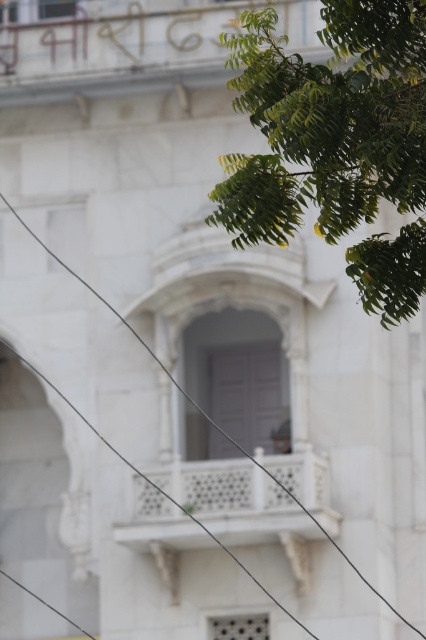
Question: Can you confirm if green leafy tree at upper right is thinner than black wire at upper left?

Choices:
 (A) no
 (B) yes

Answer: (B)

Question: Is green leafy tree at upper right bigger than black wire at upper left?

Choices:
 (A) yes
 (B) no

Answer: (B)

Question: Is green leafy tree at upper right positioned before black wire at upper left?

Choices:
 (A) yes
 (B) no

Answer: (A)